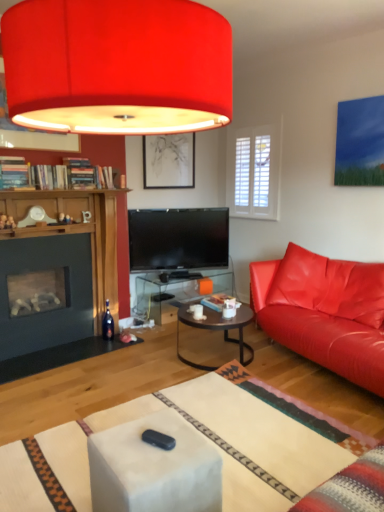
At what (x,y) coordinates should I click in order to perform the action: click on matte red lampshade at upper center. Please return your answer as a coordinate pair (x, y). Image resolution: width=384 pixels, height=512 pixels. Looking at the image, I should click on (117, 66).

Identify the location of transparent glass table at center. (177, 291).

The image size is (384, 512). What do you see at coordinates (324, 312) in the screenshot?
I see `matte leather couch at right` at bounding box center [324, 312].

What is the approximate width of dark brown glass coffee table at center?

dark brown glass coffee table at center is 26.09 inches wide.

Where is `matte black picture frame at upper center`? The height and width of the screenshot is (512, 384). matte black picture frame at upper center is located at coordinates (169, 161).

Between transparent glass table at center and dark glass wine bottle at lower left, which one is positioned behind?

Positioned behind is transparent glass table at center.

From a real-world perspective, which object stands above the other?

dark glass wine bottle at lower left.

Is transparent glass table at center outside of dark glass wine bottle at lower left?

That's correct, transparent glass table at center is outside of dark glass wine bottle at lower left.

Is transparent glass table at center positioned with its back to dark glass wine bottle at lower left?

No, transparent glass table at center is not facing the opposite direction of dark glass wine bottle at lower left.

Is matte leather couch at right facing away from dark brown glass coffee table at center?

matte leather couch at right is not turned away from dark brown glass coffee table at center.

Does matte leather couch at right have a smaller size compared to dark brown glass coffee table at center?

Actually, matte leather couch at right might be larger than dark brown glass coffee table at center.

From a real-world perspective, between matte leather couch at right and dark brown glass coffee table at center, who is vertically lower?

From a 3D spatial view, dark brown glass coffee table at center is below.

Is matte black picture frame at upper center beside dark brown glass coffee table at center?

No, matte black picture frame at upper center is not making contact with dark brown glass coffee table at center.

Considering the points (190, 162) and (177, 348), which point is behind, point (190, 162) or point (177, 348)?

Positioned behind is point (190, 162).

Could you tell me if matte black picture frame at upper center is turned towards dark brown glass coffee table at center?

No, matte black picture frame at upper center is not turned towards dark brown glass coffee table at center.

Is matte black picture frame at upper center to the right of dark brown glass coffee table at center from the viewer's perspective?

No, matte black picture frame at upper center is not to the right of dark brown glass coffee table at center.

Considering the positions of point (216, 323) and point (171, 114), is point (216, 323) closer or farther from the camera than point (171, 114)?

Point (216, 323) is farther from the camera than point (171, 114).

Measure the distance from dark brown glass coffee table at center to matte red lampshade at upper center.

They are 1.90 meters apart.

Would you say dark brown glass coffee table at center is inside or outside matte red lampshade at upper center?

dark brown glass coffee table at center exists outside the volume of matte red lampshade at upper center.

Does dark brown glass coffee table at center touch matte red lampshade at upper center?

They are not placed beside each other.

Measure the distance between matte black picture frame at upper center and matte red lampshade at upper center.

A distance of 8.40 feet exists between matte black picture frame at upper center and matte red lampshade at upper center.

Is point (156, 166) positioned before point (7, 79)?

No, it is behind (7, 79).

Considering the relative sizes of matte black picture frame at upper center and matte red lampshade at upper center in the image provided, is matte black picture frame at upper center taller than matte red lampshade at upper center?

Incorrect, the height of matte black picture frame at upper center is not larger of that of matte red lampshade at upper center.

From the picture: Can you see matte black picture frame at upper center touching matte red lampshade at upper center?

No, matte black picture frame at upper center is not next to matte red lampshade at upper center.

Does dark brown glass coffee table at center have a greater height compared to transparent glass table at center?

In fact, dark brown glass coffee table at center may be shorter than transparent glass table at center.

In terms of width, does dark brown glass coffee table at center look wider or thinner when compared to transparent glass table at center?

In the image, dark brown glass coffee table at center appears to be wider than transparent glass table at center.

Is dark brown glass coffee table at center directly adjacent to transparent glass table at center?

No, dark brown glass coffee table at center is not touching transparent glass table at center.

From a real-world perspective, which object rests below the other?

From a 3D spatial view, dark brown glass coffee table at center is below.

Based on their sizes in the image, would you say matte leather couch at right is bigger or smaller than matte red lampshade at upper center?

Considering their sizes, matte leather couch at right takes up more space than matte red lampshade at upper center.

Considering the positions of objects matte leather couch at right and matte red lampshade at upper center in the image provided, who is in front, matte leather couch at right or matte red lampshade at upper center?

matte red lampshade at upper center is closer to the camera.

From the image's perspective, is matte leather couch at right on top of matte red lampshade at upper center?

No, from the image's perspective, matte leather couch at right is not on top of matte red lampshade at upper center.

Locate an element on the screen. This screenshot has height=512, width=384. table lying behind the dark glass wine bottle at lower left is located at coordinates (177, 291).

Identify the location of coffee table on the left of the matte leather couch at right. This screenshot has height=512, width=384. tap(218, 329).

Considering their positions, is transparent glass table at center positioned closer to dark brown glass coffee table at center than dark glass wine bottle at lower left?

transparent glass table at center is closer to dark brown glass coffee table at center.

Looking at the image, which one is located closer to matte red lampshade at upper center, dark glass wine bottle at lower left or matte black picture frame at upper center?

dark glass wine bottle at lower left is positioned closer to the anchor matte red lampshade at upper center.

Considering their positions, is matte leather couch at right positioned closer to dark brown glass coffee table at center than matte red lampshade at upper center?

The object closer to dark brown glass coffee table at center is matte leather couch at right.

Looking at this image, when comparing their distances from dark glass wine bottle at lower left, does transparent glass table at center or matte black picture frame at upper center seem further?

Among the two, matte black picture frame at upper center is located further to dark glass wine bottle at lower left.

From the picture: Based on their spatial positions, is matte red lampshade at upper center or dark brown glass coffee table at center further from transparent glass table at center?

Among the two, matte red lampshade at upper center is located further to transparent glass table at center.

From the image, which object appears to be nearer to matte leather couch at right, matte red lampshade at upper center or dark glass wine bottle at lower left?

Among the two, dark glass wine bottle at lower left is located nearer to matte leather couch at right.

From the image, which object appears to be farther from dark brown glass coffee table at center, matte black picture frame at upper center or matte leather couch at right?

matte black picture frame at upper center is positioned further to the anchor dark brown glass coffee table at center.

Looking at the image, which one is located further to matte red lampshade at upper center, matte black picture frame at upper center or dark glass wine bottle at lower left?

The object further to matte red lampshade at upper center is matte black picture frame at upper center.

At what (x,y) coordinates should I click in order to perform the action: click on studio couch between matte red lampshade at upper center and matte black picture frame at upper center along the z-axis. Please return your answer as a coordinate pair (x, y). This screenshot has height=512, width=384. Looking at the image, I should click on (324, 312).

You are a GUI agent. You are given a task and a screenshot of the screen. Output one action in this format:
    pyautogui.click(x=<x>, y=<y>)
    Task: Click on the wine bottle between matte red lampshade at upper center and matte black picture frame at upper center along the z-axis
    
    Given the screenshot: What is the action you would take?
    point(108,324)

Find the location of a particular element. This screenshot has width=384, height=512. coffee table located between matte red lampshade at upper center and dark glass wine bottle at lower left in the depth direction is located at coordinates 218,329.

Where is `studio couch located between matte red lampshade at upper center and dark glass wine bottle at lower left in the depth direction`? The height and width of the screenshot is (512, 384). studio couch located between matte red lampshade at upper center and dark glass wine bottle at lower left in the depth direction is located at coordinates (324, 312).